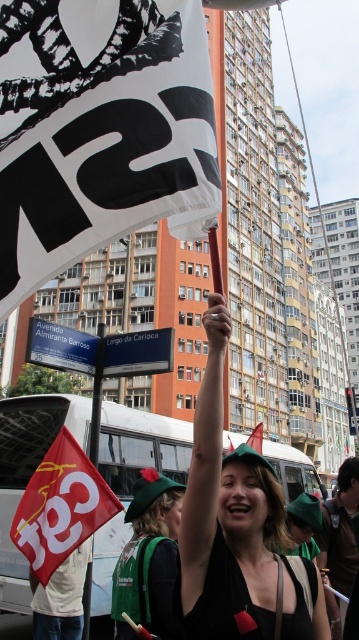
Question: In this image, where is green felt hat at upper center located relative to white fabric flag at center?

Choices:
 (A) above
 (B) below

Answer: (A)

Question: Which object appears closest to the camera in this image?

Choices:
 (A) white paper flag at upper center
 (B) green felt hat at upper center

Answer: (A)

Question: Considering the relative positions of white paper flag at upper center and white paper flag at center in the image provided, where is white paper flag at upper center located with respect to white paper flag at center?

Choices:
 (A) above
 (B) below

Answer: (A)

Question: Which of the following is the farthest from the observer?

Choices:
 (A) white paper flag at upper center
 (B) green felt hat at upper center
 (C) white fabric flag at center
 (D) white paper flag at center

Answer: (C)

Question: Does green felt hat at upper center appear over white fabric flag at center?

Choices:
 (A) no
 (B) yes

Answer: (B)

Question: Among these points, which one is nearest to the camera?

Choices:
 (A) (81, 474)
 (B) (193, 584)
 (C) (252, 436)
 (D) (98, 234)

Answer: (D)